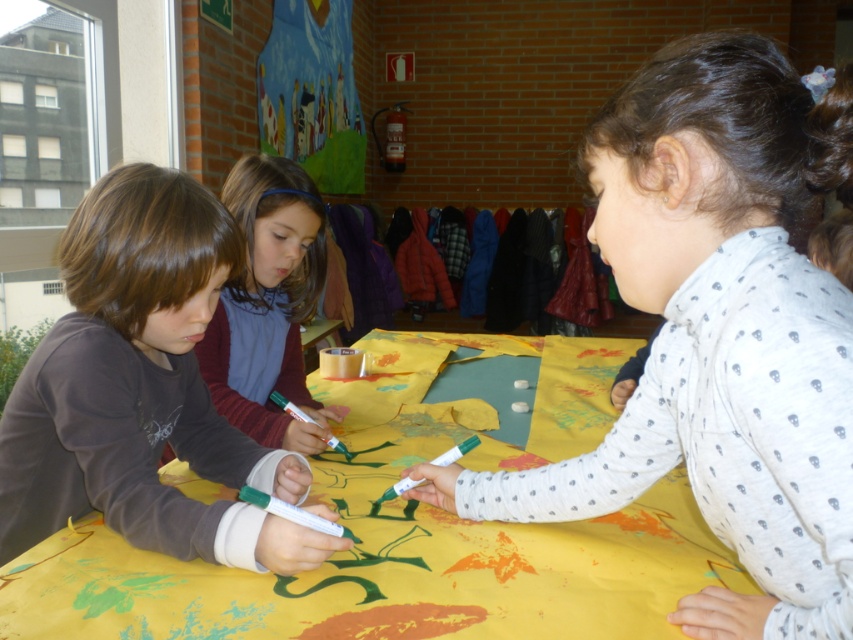
You are standing in front of the classroom table where children are painting. There is a point marked at coordinates (380, 612) on the table. If you want to place a 24 inch ruler on the table so that one end aligns with this point, will the ruler fit entirely on the table without hanging off the edge?

The point at coordinates (380, 612) is 24.70 inches from the camera. Since the ruler is 24 inches long, placing it with one end at this point would leave 0.7 inches of space between the ruler and the edge of the table, so the ruler will fit entirely on the table without hanging off the edge.

You are a teacher observing the children at the table with yellow paper. Which child is closer to you, the one with dark brown hair at left or the one wearing the matte brown shirt at center?

The dark brown hair at left is closer to you because it is in front of the matte brown shirt at center.